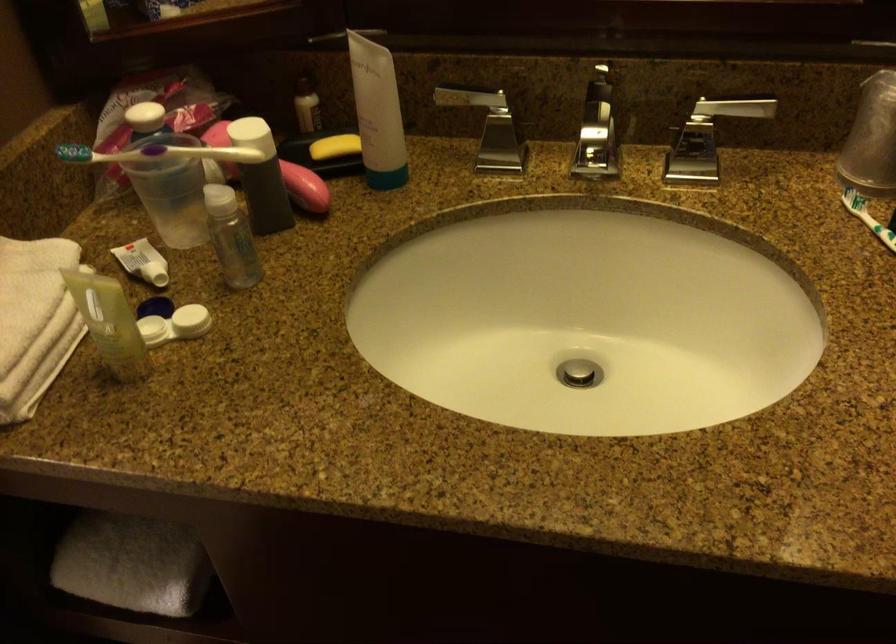
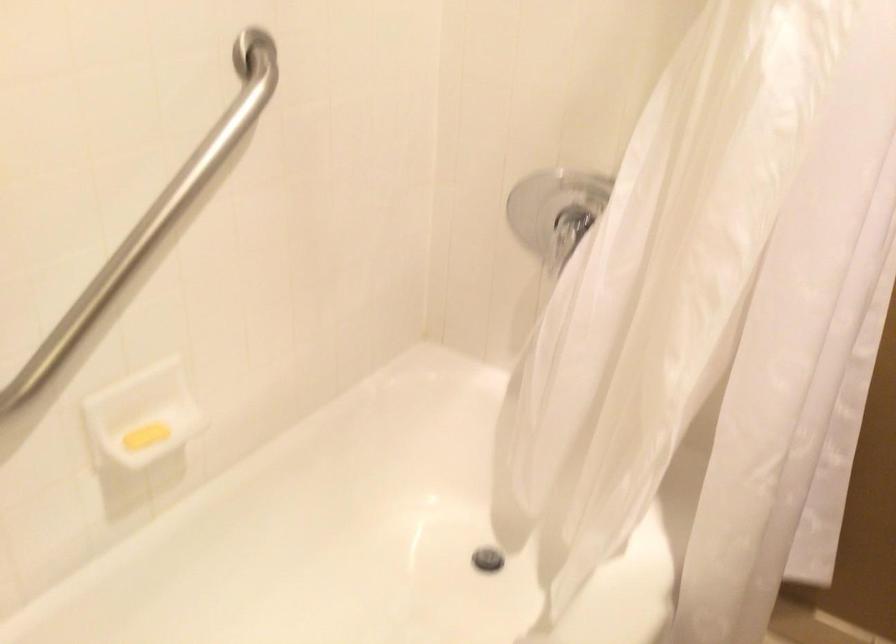
First-person continuous shooting, in which direction is the camera rotating?

The camera rotated toward left-down.